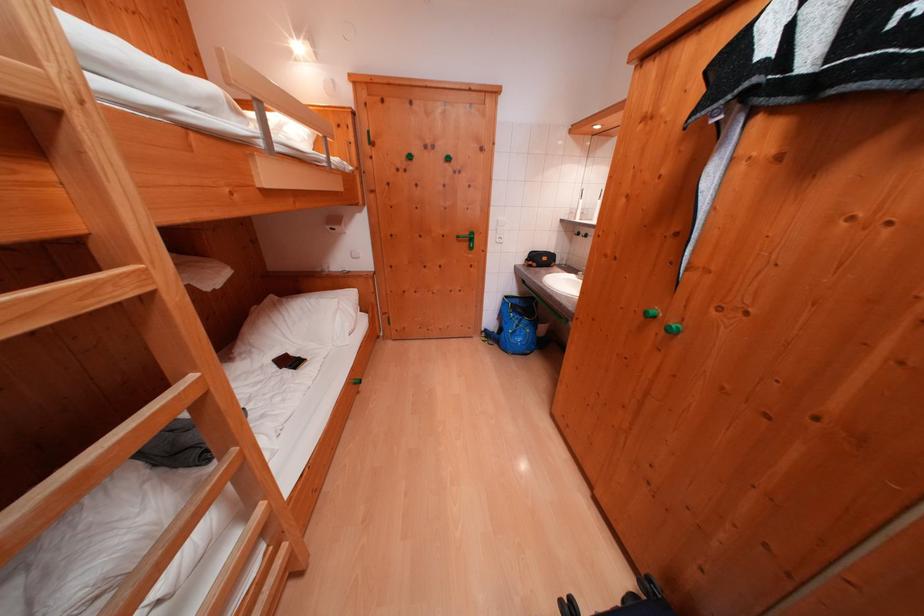
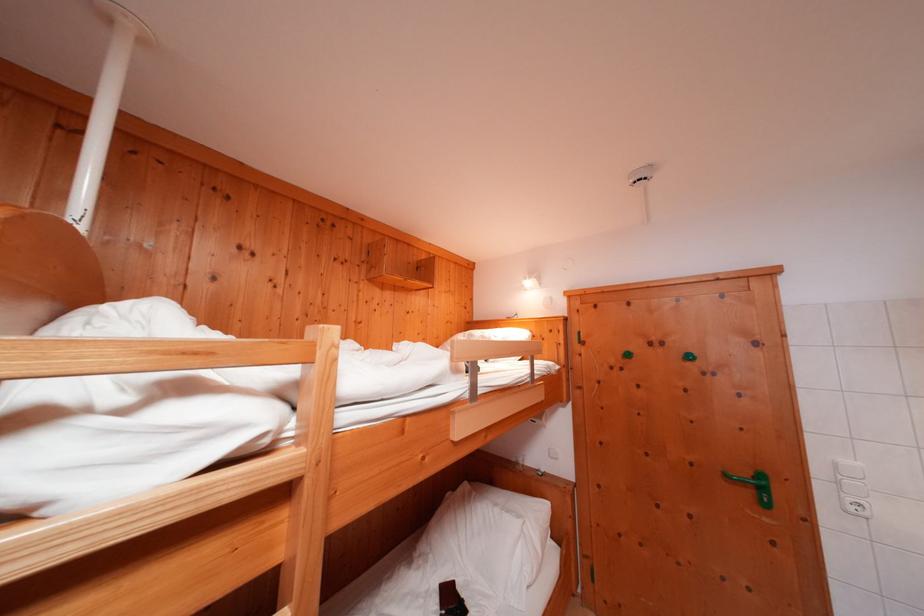
Locate, in the second image, the point that corresponds to pixel 284 371 in the first image.

(446, 604)